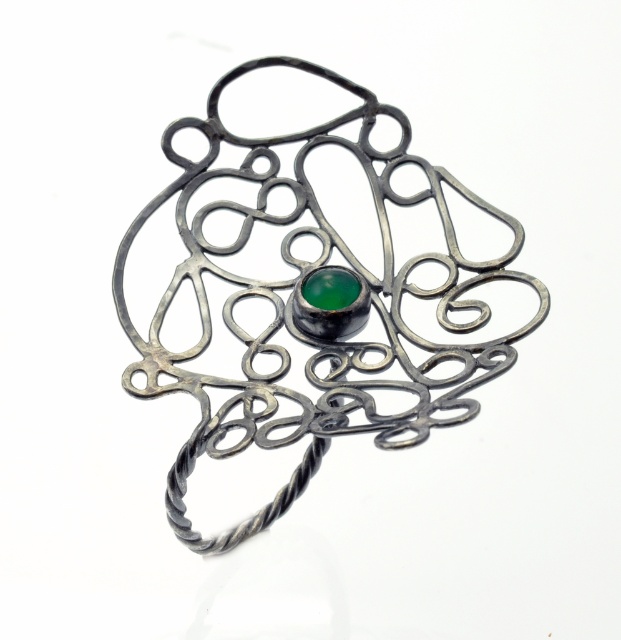
You are an appraiser examining a piece of jewelry. You notice two central elements, the polished silver ring at center and the green glass at center. Which of these two items is wider?

The polished silver ring at center is wider than the green glass at center.

You are a jeweler examining the jewelry piece. You notice two central elements, the polished silver ring at center and the green glass at center. Which one has a larger size?

The polished silver ring at center is bigger than the green glass at center, so the polished silver ring at center has a larger size.